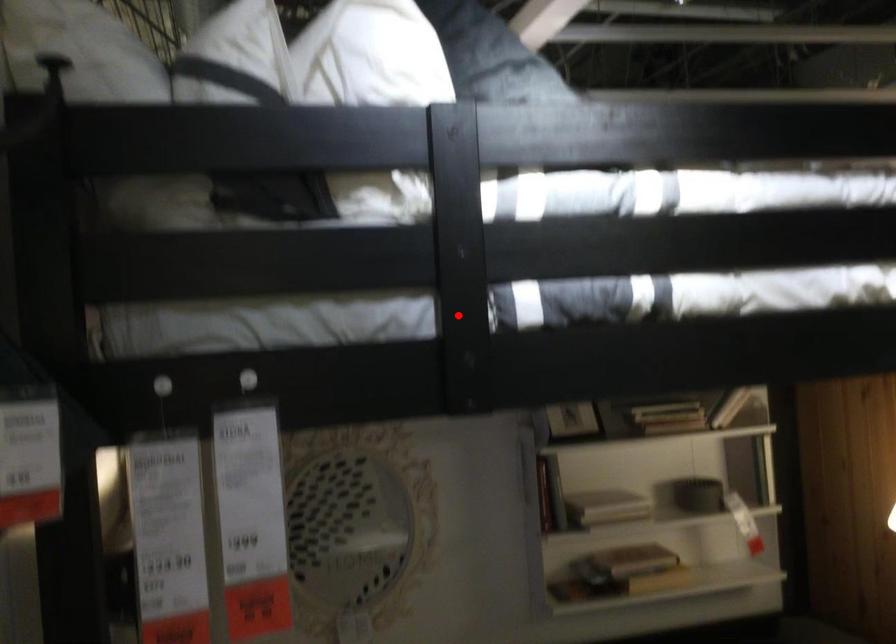
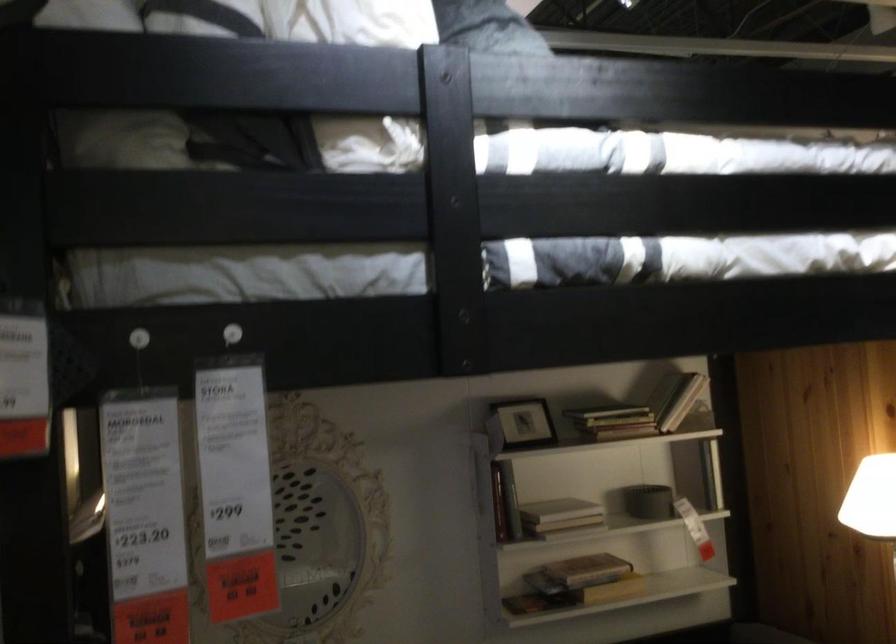
In the second image, find the point that corresponds to the highlighted location in the first image.

(455, 270)